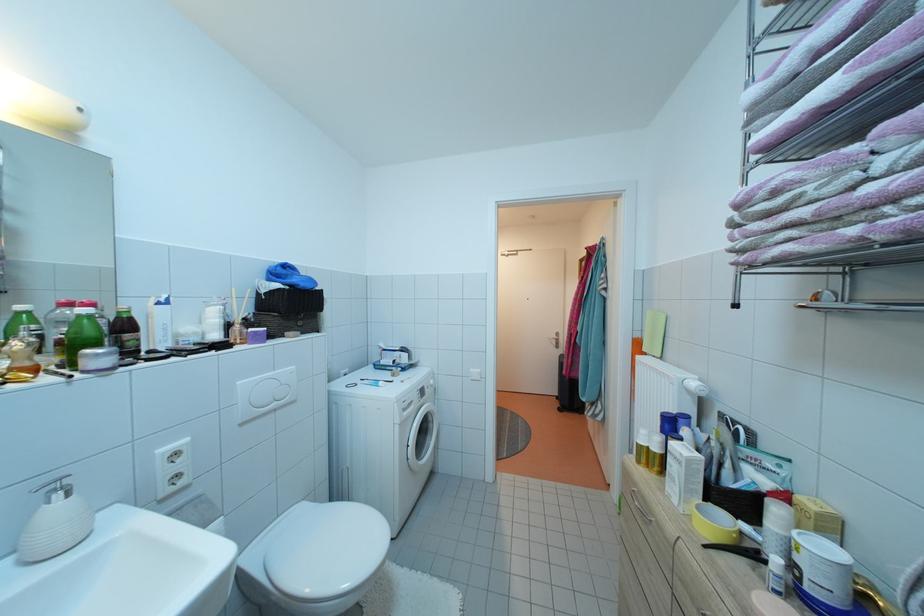
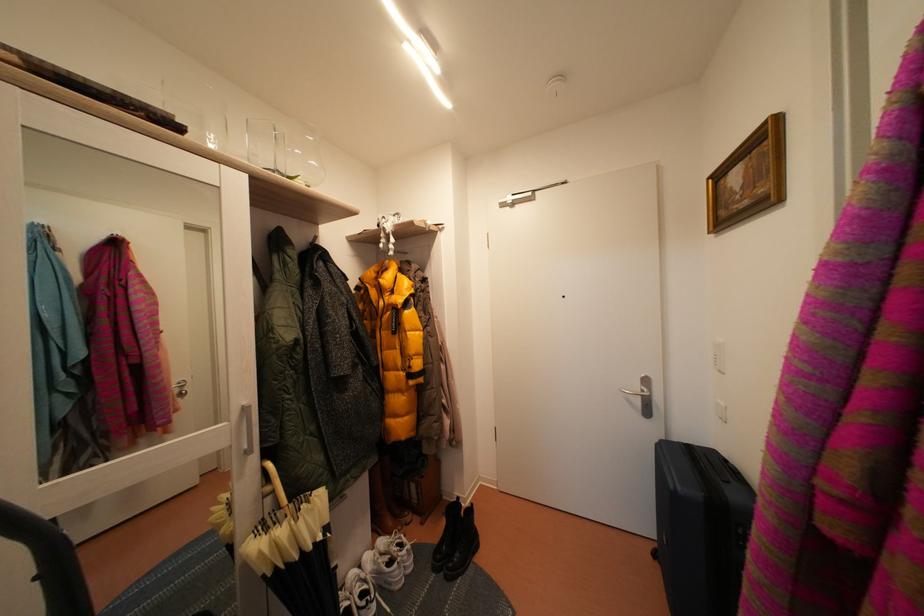
Which direction would the cameraman need to move to produce the second image?

The movement direction of the cameraman is right, forward.